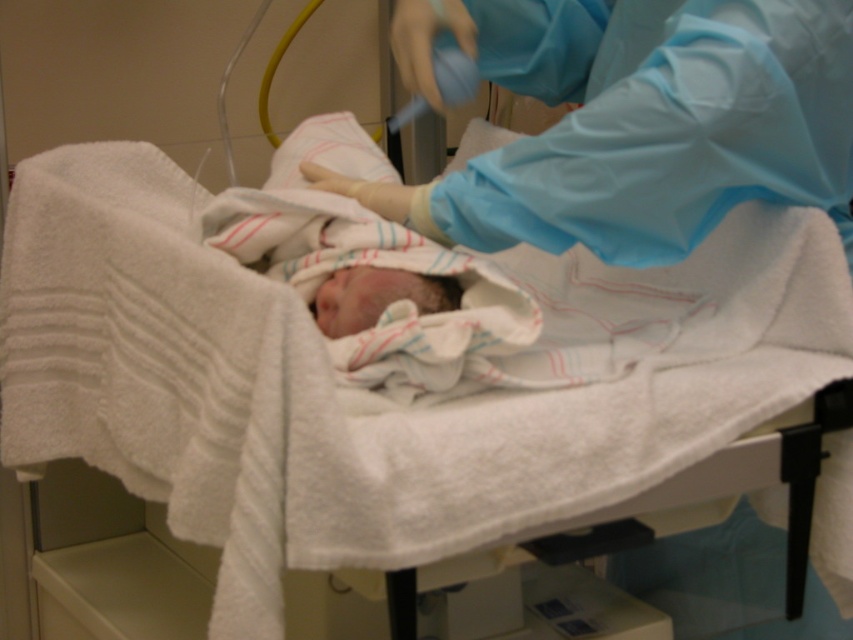
Does point (602, 148) come farther from viewer compared to point (334, 317)?

No, it is not.

Does blue smooth gown at upper right appear under soft white swaddle at center?

Incorrect, blue smooth gown at upper right is not positioned below soft white swaddle at center.

Where is `blue smooth gown at upper right`? The image size is (853, 640). blue smooth gown at upper right is located at coordinates (645, 124).